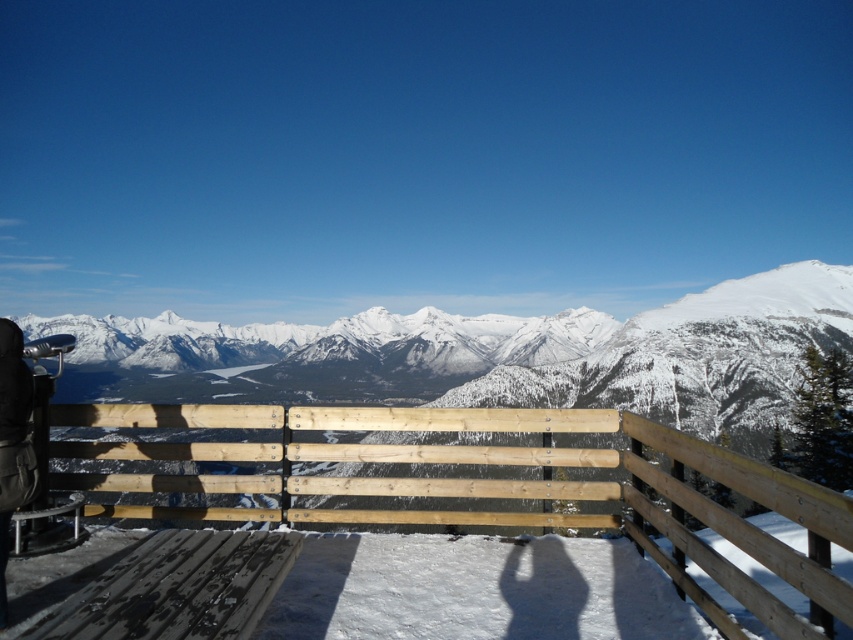
Is point (526, 493) closer to viewer compared to point (13, 460)?

No, it is not.

Measure the distance from light brown wood at center to black leather jacket at left.

They are 10.30 meters apart.

The width and height of the screenshot is (853, 640). Describe the element at coordinates (498, 488) in the screenshot. I see `light brown wood at center` at that location.

Locate an element on the screen. The width and height of the screenshot is (853, 640). light brown wood at center is located at coordinates (498, 488).